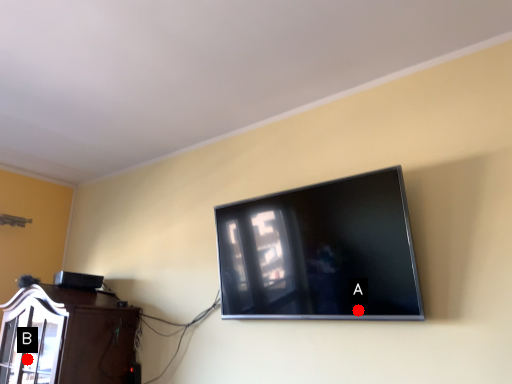
Question: Two points are circled on the image, labeled by A and B beside each circle. Which point is closer to the camera taking this photo?

Choices:
 (A) A is closer
 (B) B is closer

Answer: (A)